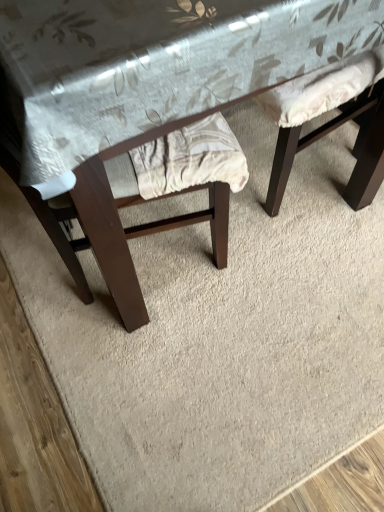
Question: Does wooden table at center have a greater width compared to matte fabric swivel chair at upper right?

Choices:
 (A) no
 (B) yes

Answer: (B)

Question: Is matte fabric swivel chair at upper right a part of wooden table at center?

Choices:
 (A) no
 (B) yes

Answer: (B)

Question: Can you confirm if wooden table at center is shorter than matte fabric swivel chair at upper right?

Choices:
 (A) no
 (B) yes

Answer: (A)

Question: Can you confirm if wooden table at center is smaller than matte fabric swivel chair at upper right?

Choices:
 (A) yes
 (B) no

Answer: (B)

Question: Would you say wooden table at center is outside matte fabric swivel chair at upper right?

Choices:
 (A) yes
 (B) no

Answer: (A)

Question: From the image's perspective, does wooden table at center appear lower than matte fabric swivel chair at upper right?

Choices:
 (A) no
 (B) yes

Answer: (A)

Question: Is matte fabric swivel chair at upper right bigger than wooden table at center?

Choices:
 (A) yes
 (B) no

Answer: (B)

Question: Is matte fabric swivel chair at upper right directly adjacent to wooden table at center?

Choices:
 (A) no
 (B) yes

Answer: (A)

Question: Can you confirm if matte fabric swivel chair at upper right is smaller than wooden table at center?

Choices:
 (A) yes
 (B) no

Answer: (A)

Question: From a real-world perspective, is matte fabric swivel chair at upper right on top of wooden table at center?

Choices:
 (A) no
 (B) yes

Answer: (A)

Question: Is matte fabric swivel chair at upper right positioned far away from wooden table at center?

Choices:
 (A) no
 (B) yes

Answer: (A)

Question: Is matte fabric swivel chair at upper right aimed at wooden table at center?

Choices:
 (A) no
 (B) yes

Answer: (B)

Question: Considering the positions of matte fabric swivel chair at upper right and wooden table at center in the image, is matte fabric swivel chair at upper right bigger or smaller than wooden table at center?

Choices:
 (A) small
 (B) big

Answer: (A)